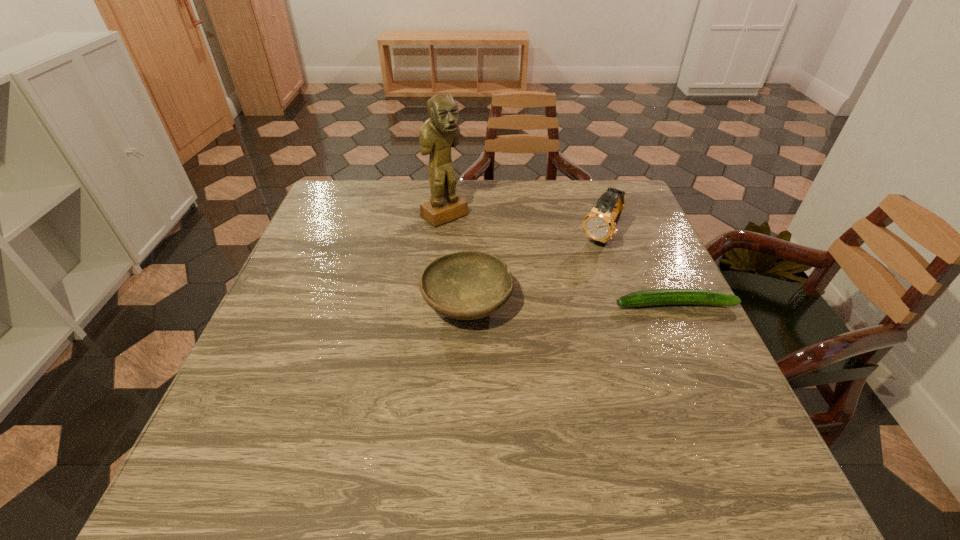
Identify the location of vacant space on the desktop that is between the third tallest object and the shortest object and is positioned on the front-facing side of the figurine. This screenshot has height=540, width=960. (558, 304).

In order to click on vacant spot on the desktop that is between the third tallest object and the zucchini and is positioned on the face of the third shortest object in this screenshot , I will do pos(549,304).